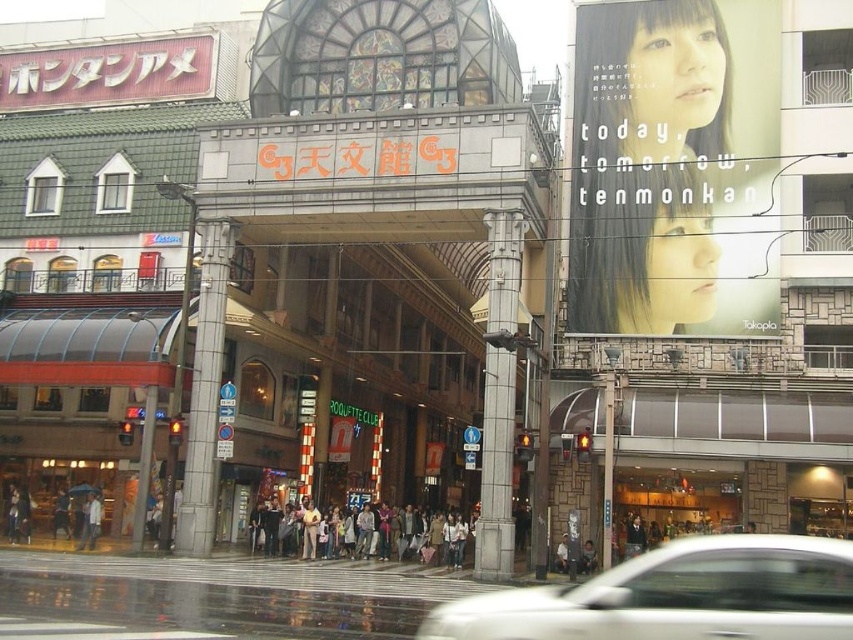
Question: Which object is closer to the camera taking this photo?

Choices:
 (A) matte gray poster at upper right
 (B) matte black crowd at center
 (C) white glossy car at lower center
 (D) dark brown leather jacket at center

Answer: (C)

Question: Can you confirm if matte gray poster at upper right is positioned to the right of light gray fabric umbrella at lower left?

Choices:
 (A) yes
 (B) no

Answer: (A)

Question: Which object is positioned farthest from the matte black crowd at center?

Choices:
 (A) light gray fabric umbrella at lower left
 (B) white glossy car at lower center

Answer: (B)

Question: Can you confirm if matte gray poster at upper right is bigger than matte black crowd at center?

Choices:
 (A) yes
 (B) no

Answer: (A)

Question: Is the position of white glossy car at lower center more distant than that of dark brown leather jacket at center?

Choices:
 (A) no
 (B) yes

Answer: (A)

Question: Among these points, which one is nearest to the camera?

Choices:
 (A) (631, 632)
 (B) (578, 564)
 (C) (399, 552)

Answer: (A)